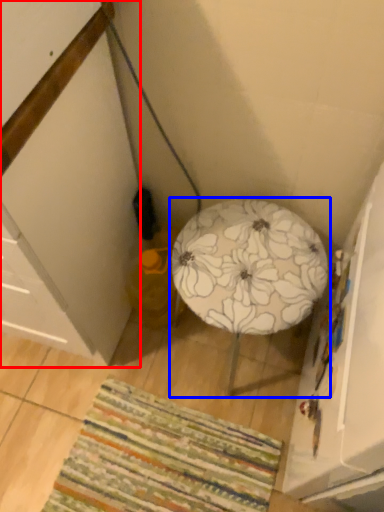
Question: Which of the following is the closest to the observer, cabinetry (highlighted by a red box) or furniture (highlighted by a blue box)?

Choices:
 (A) cabinetry
 (B) furniture

Answer: (A)